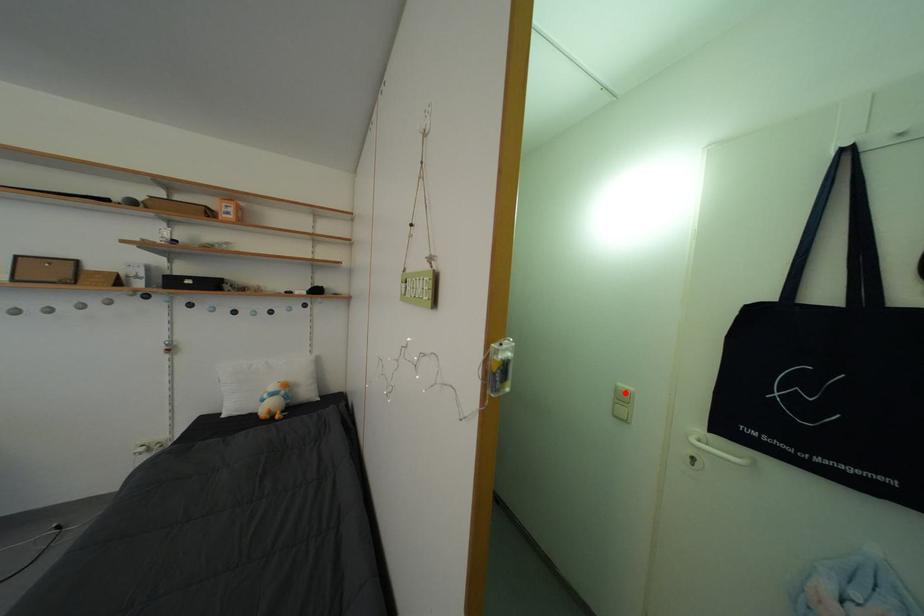
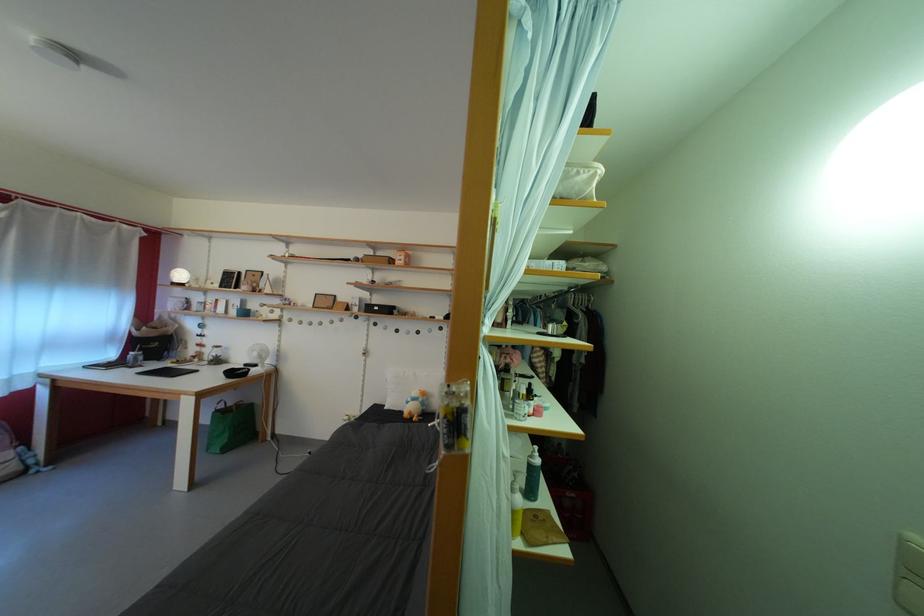
Where in the second image is the point corresponding to the highlighted location from the first image?

(913, 545)